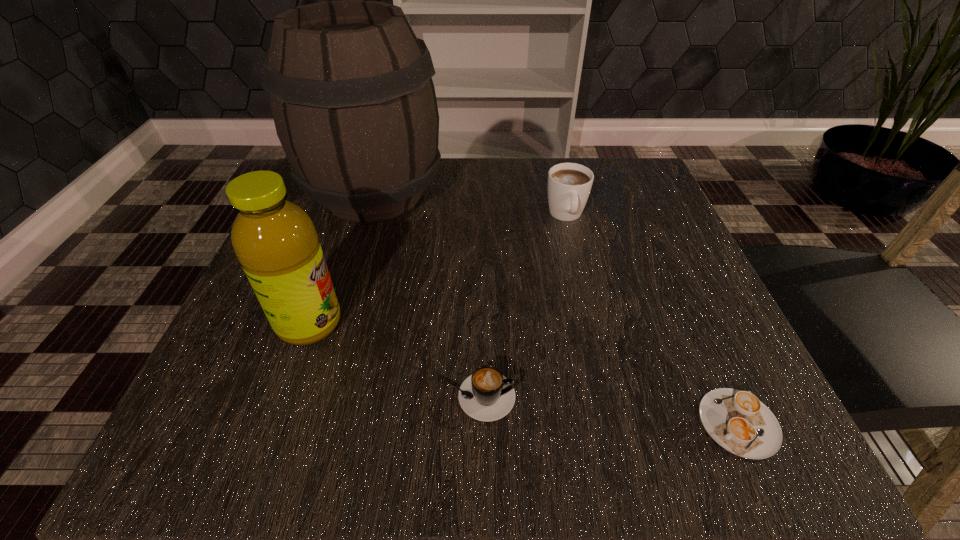
The height and width of the screenshot is (540, 960). I want to click on object that is at the near right corner, so click(738, 421).

This screenshot has height=540, width=960. In the image, there is a desktop. What are the coordinates of `vacant space at the far edge` in the screenshot? It's located at (564, 163).

In the image, there is a desktop. Where is `vacant space at the near edge`? vacant space at the near edge is located at coordinates (348, 406).

You are a GUI agent. You are given a task and a screenshot of the screen. Output one action in this format:
    pyautogui.click(x=<x>, y=<y>)
    Task: Click on the free location at the left edge of the desktop
    
    Given the screenshot: What is the action you would take?
    pyautogui.click(x=258, y=335)

In the image, there is a desktop. What are the coordinates of `free space at the right edge` in the screenshot? It's located at (693, 278).

In the image, there is a desktop. Where is `vacant space at the far right corner`? This screenshot has height=540, width=960. vacant space at the far right corner is located at coordinates (624, 165).

Where is `free area in between the third farthest object and the fourth object from left to right`? The height and width of the screenshot is (540, 960). free area in between the third farthest object and the fourth object from left to right is located at coordinates (438, 269).

You are a GUI agent. You are given a task and a screenshot of the screen. Output one action in this format:
    pyautogui.click(x=<x>, y=<y>)
    Task: Click on the free spot between the third object from left to right and the rightmost cappuccino
    The height and width of the screenshot is (540, 960).
    Given the screenshot: What is the action you would take?
    pyautogui.click(x=608, y=410)

Where is `free area in between the shortest cappuccino and the tallest cappuccino`? The width and height of the screenshot is (960, 540). free area in between the shortest cappuccino and the tallest cappuccino is located at coordinates (653, 319).

Where is `blank region between the fourth object from left to right and the wine bucket`? blank region between the fourth object from left to right and the wine bucket is located at coordinates (470, 204).